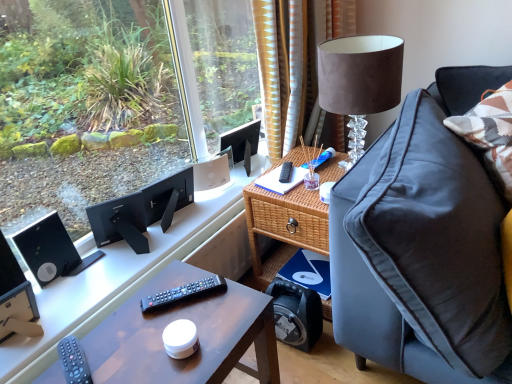
Locate an element on the screen. This screenshot has width=512, height=384. free space in front of black plastic speaker at upper left, which appears as the first loudspeaker when viewed from the back is located at coordinates (61, 303).